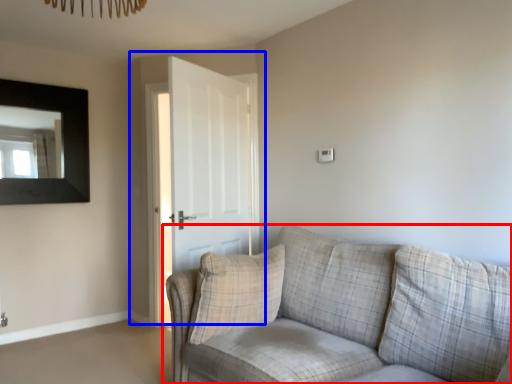
Question: Which of the following is the farthest to the observer, studio couch (highlighted by a red box) or door (highlighted by a blue box)?

Choices:
 (A) studio couch
 (B) door

Answer: (B)